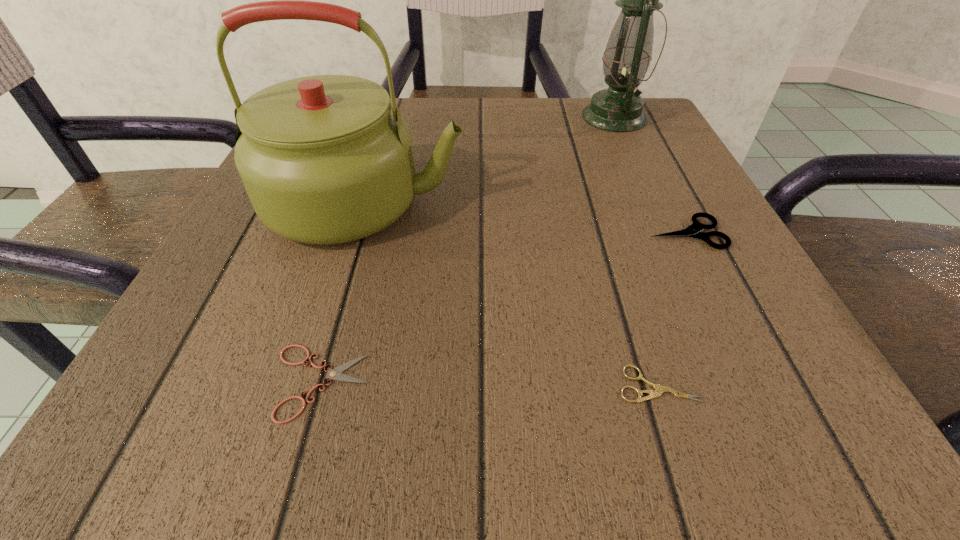
At what (x,y) coordinates should I click in order to perform the action: click on vacant space that is in between the second shears from right to left and the farthest shears. Please return your answer as a coordinate pair (x, y). The image size is (960, 540). Looking at the image, I should click on (672, 308).

Locate an element on the screen. This screenshot has height=540, width=960. empty space that is in between the farthest object and the farthest shears is located at coordinates (650, 175).

The image size is (960, 540). What are the coordinates of `free space between the second shears from left to right and the tallest shears` in the screenshot? It's located at (672, 308).

You are a GUI agent. You are given a task and a screenshot of the screen. Output one action in this format:
    pyautogui.click(x=<x>, y=<y>)
    Task: Click on the object that is the second closest one to the farthest object
    
    Given the screenshot: What is the action you would take?
    pyautogui.click(x=694, y=230)

At what (x,y) coordinates should I click in order to perform the action: click on the third closest object to the second shears from right to left. Please return your answer as a coordinate pair (x, y). The height and width of the screenshot is (540, 960). Looking at the image, I should click on coord(336,374).

Find the location of a particular element. shears object that ranks as the third closest to the kettle is located at coordinates (694, 230).

Locate which shears ranks in proximity to the rightmost shears. Please provide its 2D coordinates. Your answer should be formatted as a tuple, i.e. [(x, y)], where the tuple contains the x and y coordinates of a point satisfying the conditions above.

[(659, 389)]

At what (x,y) coordinates should I click in order to perform the action: click on free space in the image that satisfies the following two spatial constraints: 1. on the front side of the oil lamp; 2. at the spout of the kettle. Please return your answer as a coordinate pair (x, y). This screenshot has height=540, width=960. Looking at the image, I should click on (653, 203).

The width and height of the screenshot is (960, 540). What are the coordinates of `vacant space that satisfies the following two spatial constraints: 1. on the front side of the leftmost shears; 2. on the left side of the second shears from left to right` in the screenshot? It's located at (319, 384).

Locate an element on the screen. vacant region that satisfies the following two spatial constraints: 1. on the back side of the third shortest object; 2. on the right side of the second shears from left to right is located at coordinates (612, 233).